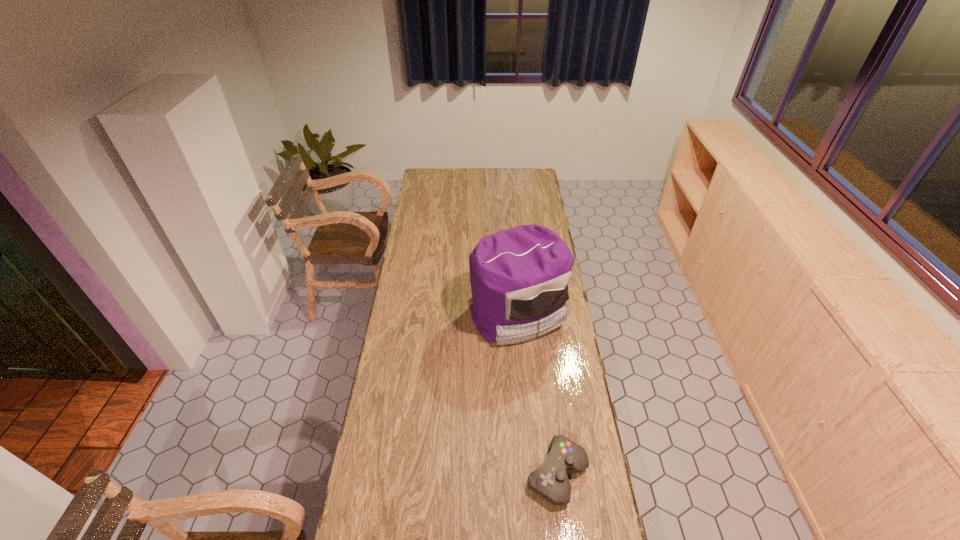
Find the location of a particular element. The image size is (960, 540). free region at the right edge of the desktop is located at coordinates [x=544, y=195].

The image size is (960, 540). In the image, there is a desktop. In order to click on vacant space at the far left corner in this screenshot , I will do `click(444, 183)`.

In the image, there is a desktop. At what (x,y) coordinates should I click in order to perform the action: click on blank space at the far right corner. Please return your answer as a coordinate pair (x, y). The image size is (960, 540). Looking at the image, I should click on click(520, 184).

Where is `free space between the backpack and the shorter object`? Image resolution: width=960 pixels, height=540 pixels. free space between the backpack and the shorter object is located at coordinates (538, 394).

What are the coordinates of `free space in the image that satisfies the following two spatial constraints: 1. on the front pocket of the farther object; 2. on the right side of the shorter object` in the screenshot? It's located at (531, 474).

Locate an element on the screen. This screenshot has width=960, height=540. vacant point that satisfies the following two spatial constraints: 1. on the front pocket of the shorter object; 2. on the right side of the farther object is located at coordinates (531, 474).